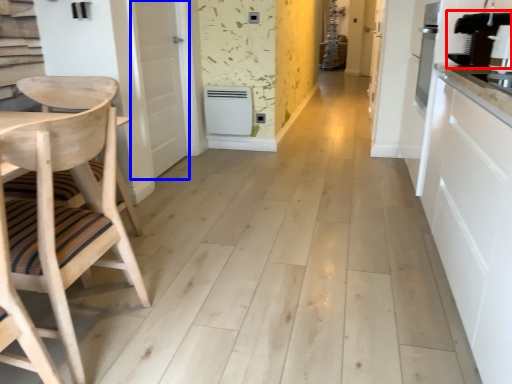
Question: Which object appears farthest to the camera in this image, coffee machine (highlighted by a red box) or door (highlighted by a blue box)?

Choices:
 (A) coffee machine
 (B) door

Answer: (B)